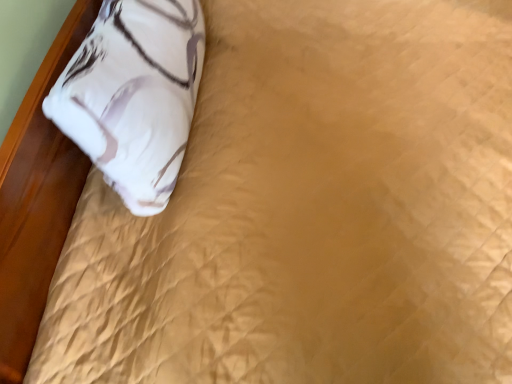
What do you see at coordinates (134, 95) in the screenshot? This screenshot has width=512, height=384. I see `white printed pillow at upper left` at bounding box center [134, 95].

Where is `white printed pillow at upper left`? The image size is (512, 384). white printed pillow at upper left is located at coordinates (134, 95).

The width and height of the screenshot is (512, 384). What are the coordinates of `white printed pillow at upper left` in the screenshot? It's located at (134, 95).